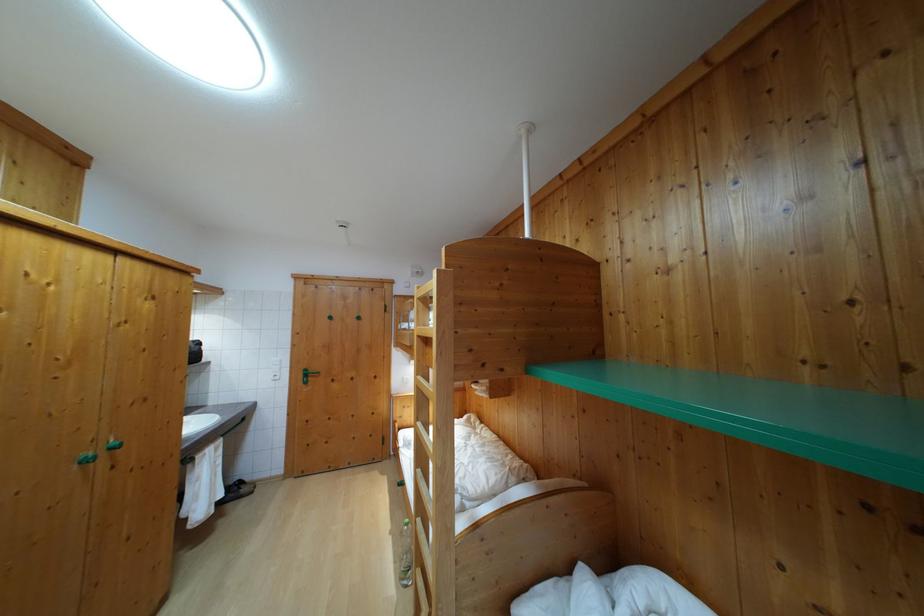
Which object does [406,554] point to?

This point indicates the plastic water bottle.